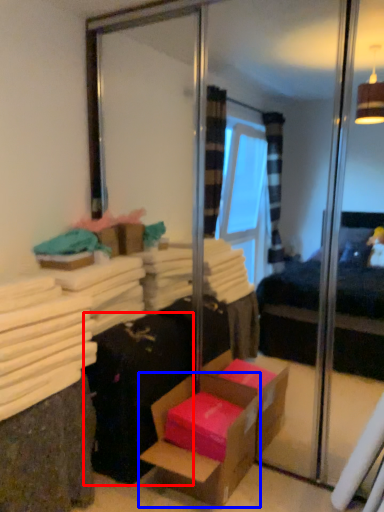
Question: Among these objects, which one is nearest to the camera, luggage (highlighted by a red box) or box (highlighted by a blue box)?

Choices:
 (A) luggage
 (B) box

Answer: (B)